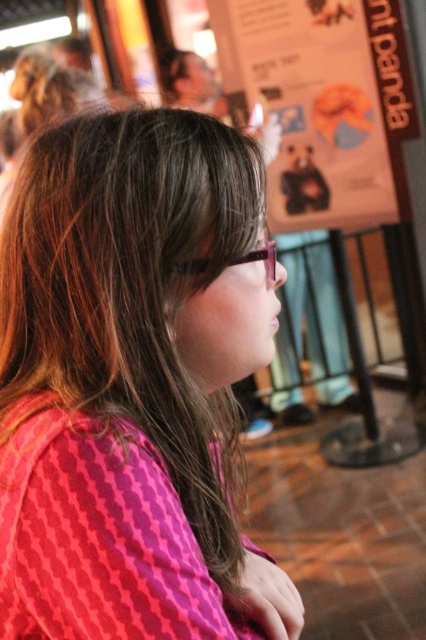
The height and width of the screenshot is (640, 426). Describe the element at coordinates (132, 385) in the screenshot. I see `pink fabric shirt at center` at that location.

Which is more to the left, pink fabric shirt at center or white paper poster at upper center?

pink fabric shirt at center is more to the left.

Is point (20, 628) closer to camera compared to point (310, 40)?

Yes, point (20, 628) is closer to viewer.

Where is `pink fabric shirt at center`? This screenshot has height=640, width=426. pink fabric shirt at center is located at coordinates (132, 385).

Who is positioned more to the left, pink fabric shirt at center or matte plastic glasses at center?

From the viewer's perspective, pink fabric shirt at center appears more on the left side.

Does pink fabric shirt at center have a lesser width compared to matte plastic glasses at center?

Incorrect, pink fabric shirt at center's width is not less than matte plastic glasses at center's.

The width and height of the screenshot is (426, 640). I want to click on pink fabric shirt at center, so click(132, 385).

Looking at this image, is white paper poster at upper center positioned before matte plastic glasses at center?

No, it is behind matte plastic glasses at center.

Which is above, white paper poster at upper center or matte plastic glasses at center?

white paper poster at upper center is above.

Who is more distant from viewer, [270,0] or [242,257]?

Positioned behind is point [270,0].

I want to click on white paper poster at upper center, so click(x=310, y=106).